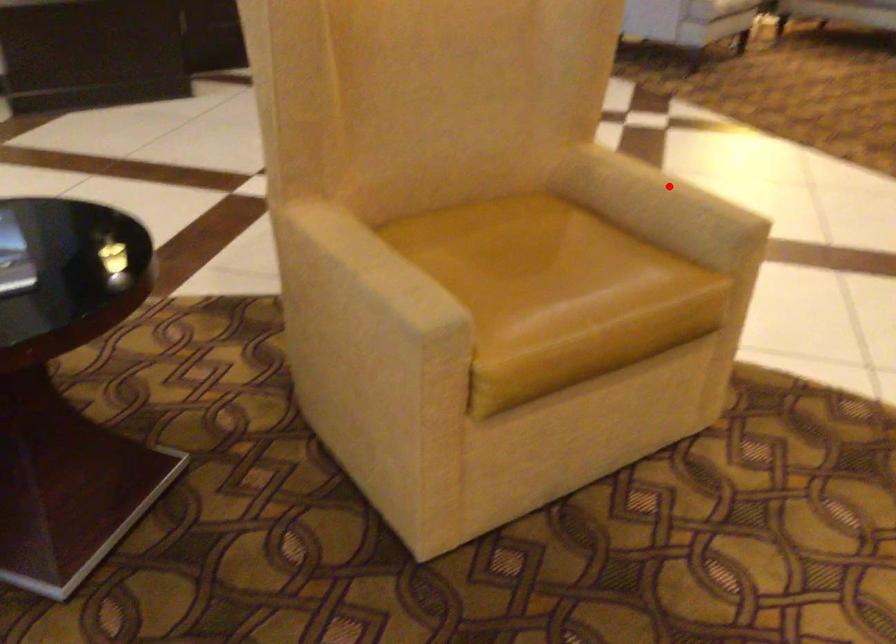
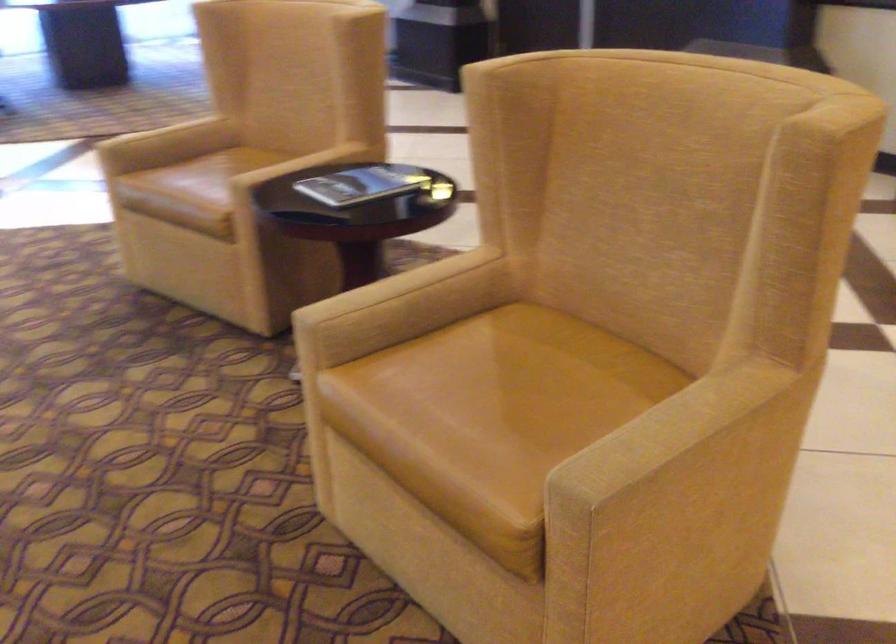
Question: A red point is marked in image1. In image2, is the corresponding 3D point closer to the camera or farther? Reply with the corresponding letter.

Choices:
 (A) The corresponding 3D point is closer.
 (B) The corresponding 3D point is farther.

Answer: (A)